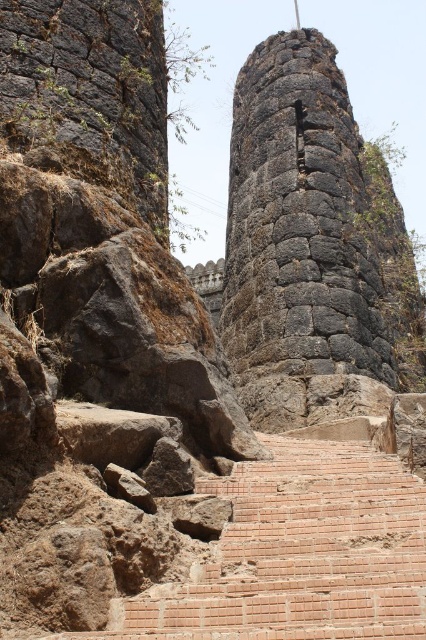
You are standing at the base of the tower and see two points marked on the structure. The first point is at coordinates point (391, 348) and the second is at point (290, 600). Which point is closer to you?

Point (290, 600) is closer to you because it is in front of point (391, 348).

Based on the photo, you are standing at the base of the tower and want to reach the point marked at coordinates (235, 100). Given that the stairs leading up to the tower are 200 feet long, can you safely reach that point without needing to climb the stairs?

The point marked at coordinates (235, 100) is 354.78 feet away from the camera. Since the stairs are only 200 feet long, you would need to climb the stairs to reach the point as the distance exceeds the stairs length.

You are a tour guide explaining the historical site to visitors. You want to emphasize the size difference between the rough stone tower at center and the brick stairs at lower center. How would you phrase this comparison in your tour?

The rough stone tower at center is wider than the brick stairs at lower center, so it appears more imposing and dominant in the scene.